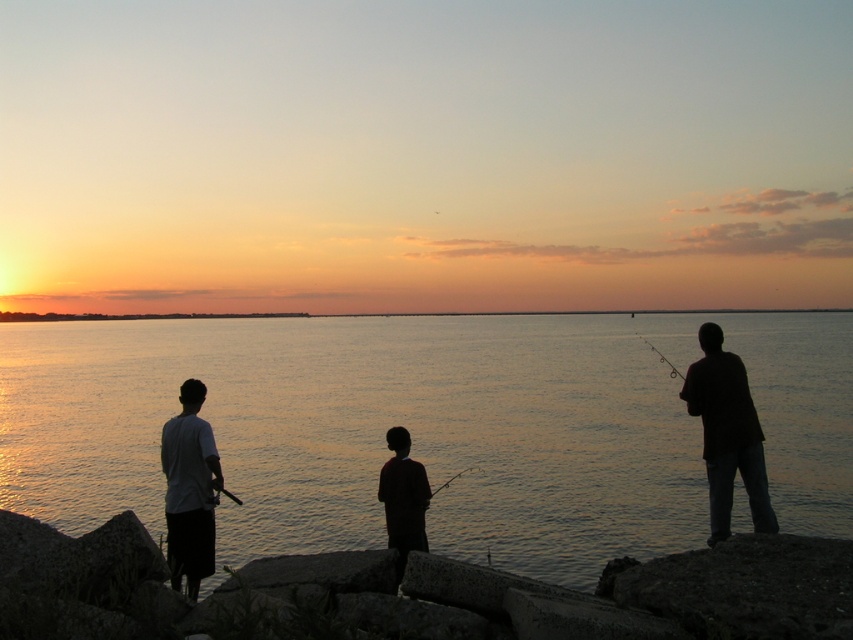
Question: Which point is closer to the camera taking this photo?

Choices:
 (A) (666, 360)
 (B) (183, 483)

Answer: (B)

Question: Is white matte shirt at left positioned in front of smooth black rod at center?

Choices:
 (A) yes
 (B) no

Answer: (A)

Question: Estimate the real-world distances between objects in this image. Which object is closer to the metallic fishing pole at right?

Choices:
 (A) silvery water at center
 (B) black matte shirt at center
 (C) white matte shirt at left
 (D) dark silhouette fishing rod at right

Answer: (D)

Question: Among these objects, which one is nearest to the camera?

Choices:
 (A) metallic fishing pole at right
 (B) black matte shirt at center

Answer: (B)

Question: Can you confirm if white matte shirt at left is positioned to the left of metallic fishing pole at right?

Choices:
 (A) no
 (B) yes

Answer: (B)

Question: Does white matte shirt at left have a smaller size compared to smooth black rod at center?

Choices:
 (A) yes
 (B) no

Answer: (A)